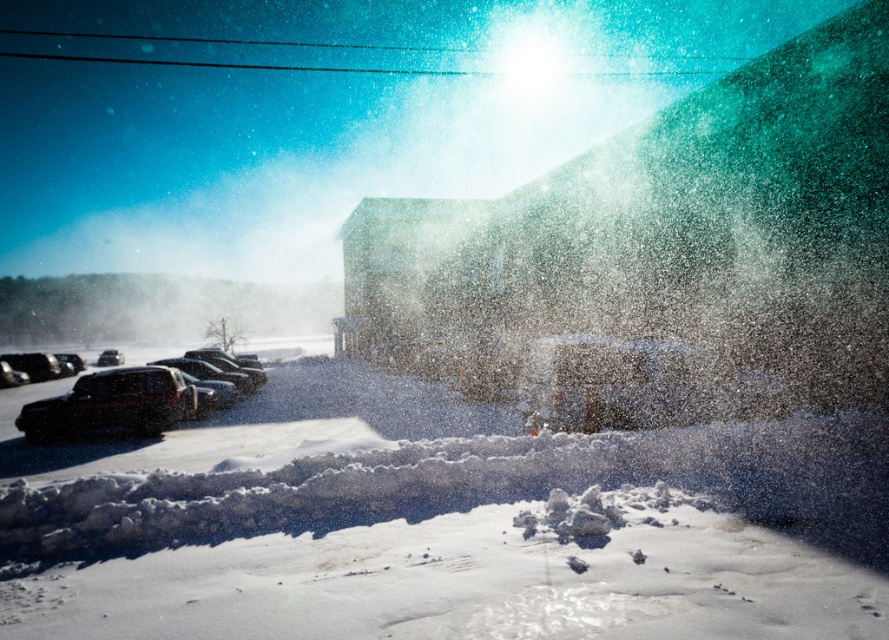
You are a delivery person trying to park your van between the black matte car at lower left and the matte black car at left. Can you fit your van, which is 6 meters long, in the space between them?

The black matte car at lower left is smaller than the matte black car at left, but the exact distance between them isn not provided. Without knowing the space between the two cars, it is impossible to determine if the van will fit.

You are standing at the origin point of the coordinate system in the image. You want to move towards the metallic silver car at center. Which direction should you move in the image?

Since the metallic silver car at center is located at coordinate point 0.603 on the x axis and 0.718 on the y axis, you should move towards the right and upwards in the image to reach it.

You are a delivery person trying to park your 1.8 meters tall delivery cart between the metallic silver car at center and the matte black car at left. Can your cart fit vertically between them?

The metallic silver car at center is taller than the matte black car at left. Since the height difference isn